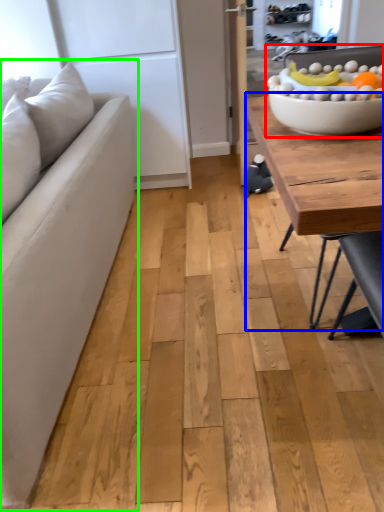
Question: Which object is positioned farthest from bowl (highlighted by a red box)? Select from coffee table (highlighted by a blue box) and studio couch (highlighted by a green box).

Choices:
 (A) coffee table
 (B) studio couch

Answer: (B)